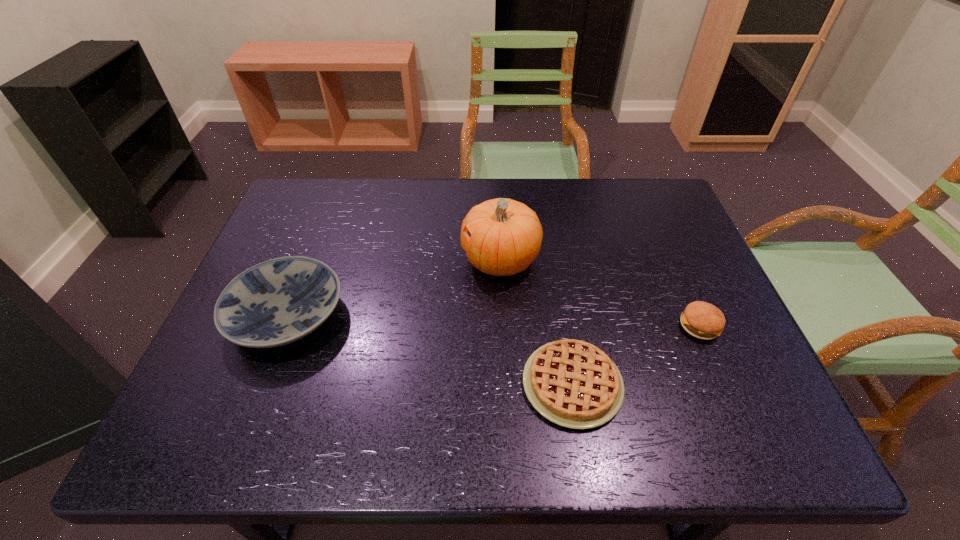
Locate an element on the screen. The width and height of the screenshot is (960, 540). vacant area that lies between the second shortest object and the pumpkin is located at coordinates (600, 293).

I want to click on empty location between the pumpkin and the pie, so click(537, 322).

Where is `vacant space in between the second tallest object and the shortest object`? vacant space in between the second tallest object and the shortest object is located at coordinates (430, 350).

This screenshot has width=960, height=540. I want to click on vacant point located between the rightmost object and the second tallest object, so (x=493, y=321).

At what (x,y) coordinates should I click in order to perform the action: click on free point between the hamburger and the third shortest object. Please return your answer as a coordinate pair (x, y). Looking at the image, I should click on (493, 321).

Where is `unoccupied position between the hamburger and the shortest object`? unoccupied position between the hamburger and the shortest object is located at coordinates (636, 355).

Locate an element on the screen. vacant region between the pie and the leftmost object is located at coordinates (430, 350).

The image size is (960, 540). In order to click on free spot between the pumpkin and the pie in this screenshot , I will do `click(537, 322)`.

Locate an element on the screen. Image resolution: width=960 pixels, height=540 pixels. vacant area between the second tallest object and the shortest object is located at coordinates (x=430, y=350).

Image resolution: width=960 pixels, height=540 pixels. Find the location of `blank region between the shortest object and the third shortest object`. blank region between the shortest object and the third shortest object is located at coordinates (430, 350).